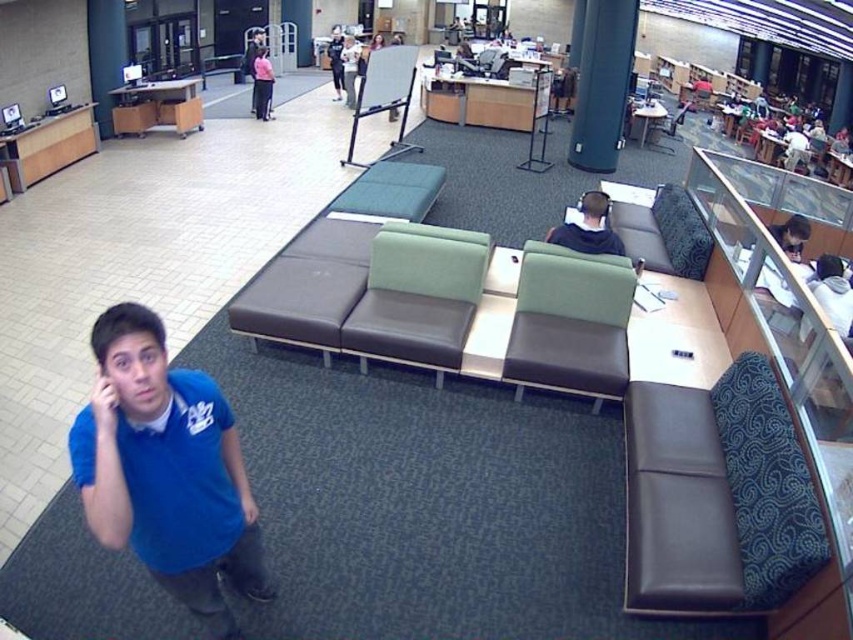
In the scene shown: Does dark brown leather couch at lower right appear on the left side of green leather couch at center?

In fact, dark brown leather couch at lower right is to the right of green leather couch at center.

Can you confirm if dark brown leather couch at lower right is bigger than green leather couch at center?

Yes.

What do you see at coordinates (717, 497) in the screenshot? I see `dark brown leather couch at lower right` at bounding box center [717, 497].

In order to click on dark brown leather couch at lower right in this screenshot , I will do `click(717, 497)`.

Can you confirm if whiteboard at center is positioned below white fabric jacket at upper right?

Indeed, whiteboard at center is positioned under white fabric jacket at upper right.

Between whiteboard at center and white fabric jacket at upper right, which one is positioned higher?

Positioned higher is white fabric jacket at upper right.

Is point (341, 163) positioned behind point (791, 131)?

No, (341, 163) is closer to viewer.

What are the coordinates of `whiteboard at center` in the screenshot? It's located at (384, 96).

Is dark gray leather headphones at center positioned before matte black jacket at upper center?

Yes, it is in front of matte black jacket at upper center.

Who is more forward, (602, 241) or (253, 97)?

Point (602, 241) is in front.

Image resolution: width=853 pixels, height=640 pixels. What are the coordinates of `dark gray leather headphones at center` in the screenshot? It's located at (589, 228).